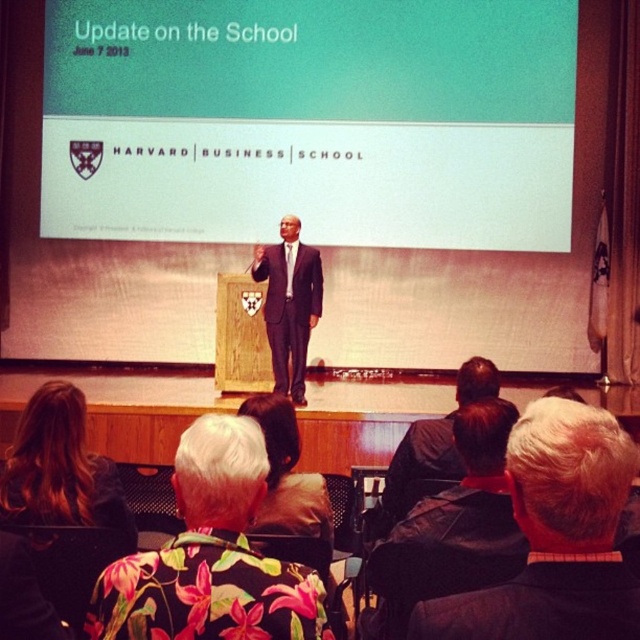
Question: Does gray hair at upper right appear on the left side of floral fabric shirt at lower left?

Choices:
 (A) yes
 (B) no

Answer: (B)

Question: Does black leather jacket at lower right appear over black suit at center?

Choices:
 (A) yes
 (B) no

Answer: (B)

Question: Does gray hair at upper right have a lesser width compared to floral fabric shirt at lower left?

Choices:
 (A) yes
 (B) no

Answer: (A)

Question: Among these objects, which one is farthest from the camera?

Choices:
 (A) black leather jacket at lower right
 (B) gray hair at upper right
 (C) floral fabric shirt at lower left

Answer: (C)

Question: Which of these objects is positioned farthest from the black suit at center?

Choices:
 (A) floral shirt at lower left
 (B) floral fabric shirt at lower left
 (C) black leather jacket at center
 (D) black leather jacket at lower right

Answer: (A)

Question: Considering the real-world distances, which object is farthest from the black suit at center?

Choices:
 (A) black leather jacket at center
 (B) gray hair at upper right
 (C) floral fabric shirt at lower left
 (D) floral shirt at lower left

Answer: (B)